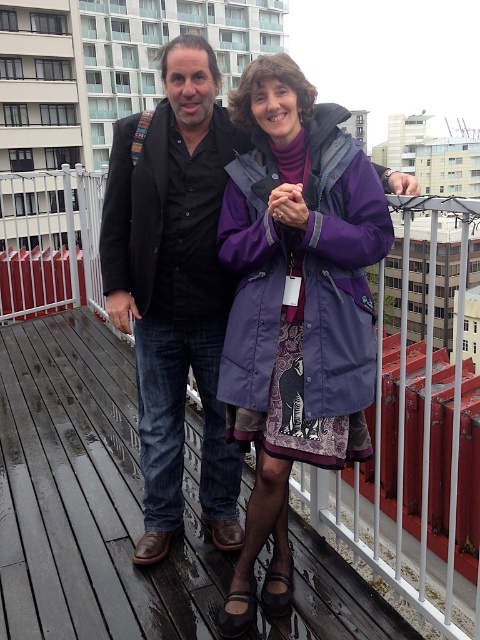
You are standing on the wooden deck and want to reach a point that is 3.79 meters away from you. Is the point located at coordinates point (96, 480) within your reach?

The point (96, 480) is 3.79 meters away from the viewer, so it is outside of typical human reach. You would need to move closer or use a tool to reach that point.

You are standing on the wooden deck and want to place a small potted plant exactly where the wooden at center is located. What are the coordinates where you should place it?

The coordinates for placing the small potted plant at the wooden at center are 0.777 in the x and 0.185 in the y direction.

You are a delivery person carrying a large box that is 1.2 meters wide. You need to walk through the space between the wooden at center and the purple matte coat at center. Can you fit through the space?

The wooden at center might be wider than purple matte coat at center, so the space between them may be sufficient for your 1.2 meter wide box. However, since the exact width isn